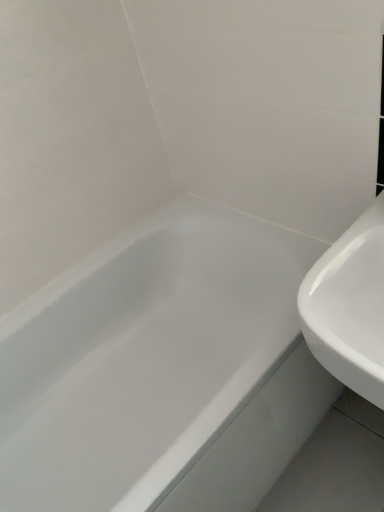
What are the coordinates of `white glossy sink at right` in the screenshot? It's located at (349, 306).

The image size is (384, 512). Describe the element at coordinates (349, 306) in the screenshot. I see `white glossy sink at right` at that location.

I want to click on white glossy bathtub at center, so click(162, 371).

The width and height of the screenshot is (384, 512). Describe the element at coordinates (162, 371) in the screenshot. I see `white glossy bathtub at center` at that location.

Where is `white glossy sink at right`? This screenshot has width=384, height=512. white glossy sink at right is located at coordinates (349, 306).

Is white glossy bathtub at center to the right of white glossy sink at right from the viewer's perspective?

In fact, white glossy bathtub at center is to the left of white glossy sink at right.

Between white glossy bathtub at center and white glossy sink at right, which one is positioned behind?

white glossy bathtub at center is behind.

Which point is more forward, (268, 295) or (350, 230)?

The point (350, 230) is closer to the camera.

From the image's perspective, is white glossy bathtub at center positioned above or below white glossy sink at right?

Clearly, from the image's perspective, white glossy bathtub at center is below white glossy sink at right.

From a real-world perspective, which object rests below the other?

In real-world perspective, white glossy bathtub at center is lower.

Is white glossy bathtub at center thinner than white glossy sink at right?

Incorrect, the width of white glossy bathtub at center is not less than that of white glossy sink at right.

Considering the sizes of objects white glossy bathtub at center and white glossy sink at right in the image provided, who is taller, white glossy bathtub at center or white glossy sink at right?

white glossy bathtub at center is taller.

Considering the sizes of objects white glossy bathtub at center and white glossy sink at right in the image provided, who is smaller, white glossy bathtub at center or white glossy sink at right?

white glossy sink at right.

Would you say white glossy bathtub at center contains white glossy sink at right?

No, white glossy sink at right is not a part of white glossy bathtub at center.

Is white glossy bathtub at center far away from white glossy sink at right?

No, there isn't a large distance between white glossy bathtub at center and white glossy sink at right.

Is white glossy bathtub at center positioned with its back to white glossy sink at right?

No, white glossy sink at right is not at the back of white glossy bathtub at center.

Measure the distance from white glossy bathtub at center to white glossy sink at right.

white glossy bathtub at center and white glossy sink at right are 19.36 inches apart from each other.

The image size is (384, 512). In order to click on bathtub behind the white glossy sink at right in this screenshot , I will do `click(162, 371)`.

Considering the relative positions of white glossy sink at right and white glossy bathtub at center in the image provided, is white glossy sink at right to the left of white glossy bathtub at center from the viewer's perspective?

Incorrect, white glossy sink at right is not on the left side of white glossy bathtub at center.

Which is in front, white glossy sink at right or white glossy bathtub at center?

white glossy sink at right is more forward.

Is point (323, 349) closer to viewer compared to point (85, 462)?

Yes, it is.

From the image's perspective, would you say white glossy sink at right is positioned over white glossy bathtub at center?

Yes, from the image's perspective, white glossy sink at right is over white glossy bathtub at center.

From a real-world perspective, does white glossy sink at right stand above white glossy bathtub at center?

Yes, from a real-world perspective, white glossy sink at right is over white glossy bathtub at center

Is white glossy sink at right wider or thinner than white glossy bathtub at center?

Clearly, white glossy sink at right has less width compared to white glossy bathtub at center.

Does white glossy sink at right have a greater height compared to white glossy bathtub at center?

No.

Which of these two, white glossy sink at right or white glossy bathtub at center, is smaller?

With smaller size is white glossy sink at right.

Can we say white glossy sink at right lies outside white glossy bathtub at center?

Yes.

Consider the image. Would you say white glossy sink at right is a long distance from white glossy bathtub at center?

No, there isn't a large distance between white glossy sink at right and white glossy bathtub at center.

Is white glossy sink at right positioned with its back to white glossy bathtub at center?

No, white glossy sink at right's orientation is not away from white glossy bathtub at center.

How different are the orientations of white glossy sink at right and white glossy bathtub at center in degrees?

91.2 degrees.

Where is `sink in front of the white glossy bathtub at center`? Image resolution: width=384 pixels, height=512 pixels. sink in front of the white glossy bathtub at center is located at coordinates (349, 306).

This screenshot has height=512, width=384. Find the location of `bathtub on the left of white glossy sink at right`. bathtub on the left of white glossy sink at right is located at coordinates (162, 371).

Locate an element on the screen. The height and width of the screenshot is (512, 384). sink above the white glossy bathtub at center (from a real-world perspective) is located at coordinates (349, 306).